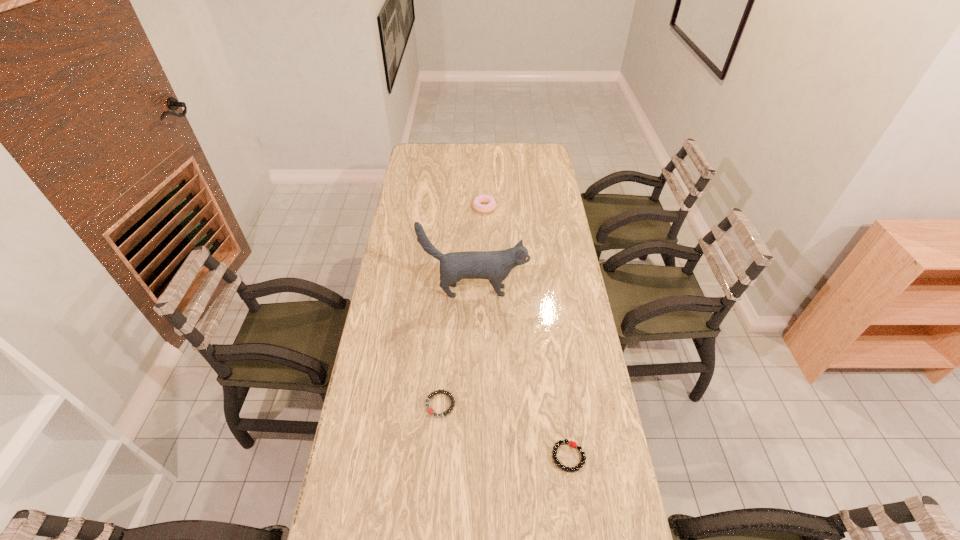
This screenshot has height=540, width=960. Identify the location of vacant space that satisfies the following two spatial constraints: 1. at the face of the tallest object; 2. on the right side of the nearer bracelet. (473, 457).

Where is `free space that satisfies the following two spatial constraints: 1. on the front side of the farther bracelet; 2. on the left side of the nearer bracelet`? The width and height of the screenshot is (960, 540). free space that satisfies the following two spatial constraints: 1. on the front side of the farther bracelet; 2. on the left side of the nearer bracelet is located at coordinates (437, 457).

At what (x,y) coordinates should I click in order to perform the action: click on vacant space that satisfies the following two spatial constraints: 1. on the front side of the nearer bracelet; 2. on the left side of the second tallest object. Please return your answer as a coordinate pair (x, y). This screenshot has width=960, height=540. Looking at the image, I should click on (488, 457).

Identify the location of vacant space that satisfies the following two spatial constraints: 1. on the front side of the doughnut; 2. at the face of the tallest object. (486, 291).

The width and height of the screenshot is (960, 540). I want to click on vacant space that satisfies the following two spatial constraints: 1. at the face of the rightmost object; 2. on the right side of the second farthest object, so 473,457.